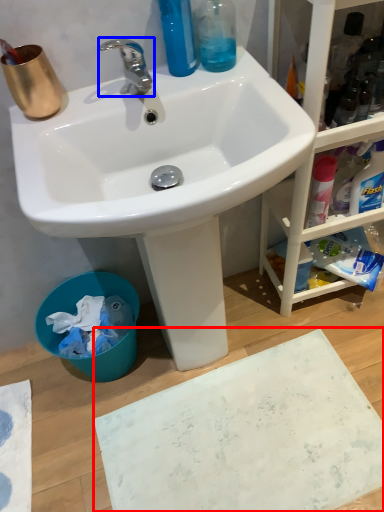
Question: Which of the following is the closest to the observer, bath mat (highlighted by a red box) or tap (highlighted by a blue box)?

Choices:
 (A) bath mat
 (B) tap

Answer: (B)